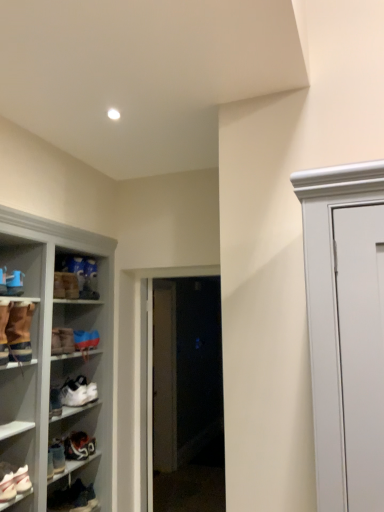
Find the location of a particular element. The height and width of the screenshot is (512, 384). matte blue sneaker at left, which is the 1th footwear in top-to-bottom order is located at coordinates (11, 282).

You are a GUI agent. You are given a task and a screenshot of the screen. Output one action in this format:
    pyautogui.click(x=<x>, y=<y>)
    Task: Click on the white matte sneaker at lower left, marked as the fourth footwear in a bottom-to-top arrangement
    This screenshot has width=384, height=512.
    Given the screenshot: What is the action you would take?
    pyautogui.click(x=72, y=395)

The height and width of the screenshot is (512, 384). I want to click on blue suede sneakers at lower left, the fifth footwear when ordered from bottom to top, so click(x=73, y=340).

Locate an element on the screen. The height and width of the screenshot is (512, 384). brown suede boot at left, the sixth footwear positioned from the bottom is located at coordinates (19, 331).

The height and width of the screenshot is (512, 384). I want to click on dark brown leather shoe at lower left, which is the 1th footwear in bottom-to-top order, so click(x=73, y=498).

Find the location of a particular element. Image resolution: width=384 pixels, height=512 pixels. white leather sneakers at lower left, the 6th footwear positioned from the top is located at coordinates (13, 481).

In order to click on transparent glass door at center in this screenshot , I will do `click(187, 396)`.

Find the location of a particular element. The height and width of the screenshot is (512, 384). matte blue sneaker at left, which is the 1th footwear in top-to-bottom order is located at coordinates (11, 282).

Is brown suede boot at left, the sixth footwear positioned from the bottom, wider or thinner than transparent glass door at center?

Clearly, brown suede boot at left, the sixth footwear positioned from the bottom, has more width compared to transparent glass door at center.

Locate an element on the screen. This screenshot has height=512, width=384. glass door that is behind the brown suede boot at left, placed as the 3th footwear when sorted from top to bottom is located at coordinates (187, 396).

From a real-world perspective, relative to transparent glass door at center, is brown suede boot at left, placed as the 3th footwear when sorted from top to bottom, vertically above or below?

Clearly, from a real-world perspective, brown suede boot at left, placed as the 3th footwear when sorted from top to bottom, is above transparent glass door at center.

Can you confirm if brown suede boot at left, placed as the 3th footwear when sorted from top to bottom, is taller than transparent glass door at center?

No.

How many degrees apart are the facing directions of matte blue sneaker at left, marked as the eighth footwear in a bottom-to-top arrangement, and white matte sneaker at lower left, which is the fifth footwear from top to bottom?

The facing directions of matte blue sneaker at left, marked as the eighth footwear in a bottom-to-top arrangement, and white matte sneaker at lower left, which is the fifth footwear from top to bottom, are 9.69 degrees apart.

Between matte blue sneaker at left, marked as the eighth footwear in a bottom-to-top arrangement, and white matte sneaker at lower left, which is the fifth footwear from top to bottom, which one has smaller width?

With smaller width is matte blue sneaker at left, marked as the eighth footwear in a bottom-to-top arrangement.

Does matte blue sneaker at left, which is the 1th footwear in top-to-bottom order, have a larger size compared to white matte sneaker at lower left, which is the fifth footwear from top to bottom?

No.

From a real-world perspective, which object stands above the other?

From a 3D spatial view, matte blue sneaker at left, marked as the eighth footwear in a bottom-to-top arrangement, is above.

Relative to blue suede sneakers at lower left, the fifth footwear when ordered from bottom to top, is white leather sneakers at lower left, the 6th footwear positioned from the top, in front or behind?

white leather sneakers at lower left, the 6th footwear positioned from the top, is positioned closer to the viewer than blue suede sneakers at lower left, the fifth footwear when ordered from bottom to top.

This screenshot has height=512, width=384. Identify the location of footwear that is the 2nd one when counting downward from the blue suede sneakers at lower left, placed as the 4th footwear when sorted from top to bottom (from the image's perspective). (13, 481).

Is white leather sneakers at lower left, arranged as the third footwear when ordered from the bottom, not near blue suede sneakers at lower left, placed as the 4th footwear when sorted from top to bottom?

No, white leather sneakers at lower left, arranged as the third footwear when ordered from the bottom, is not far from blue suede sneakers at lower left, placed as the 4th footwear when sorted from top to bottom.

Considering the points (1, 488) and (68, 338), which point is in front, point (1, 488) or point (68, 338)?

Point (1, 488)

Which object is thinner, matte brown boot at upper left, which is counted as the second footwear, starting from the top, or brown suede boot at left, the sixth footwear positioned from the bottom?

matte brown boot at upper left, which is counted as the second footwear, starting from the top.

Which object is further away from the camera taking this photo, matte brown boot at upper left, the seventh footwear in the bottom-to-top sequence, or brown suede boot at left, placed as the 3th footwear when sorted from top to bottom?

matte brown boot at upper left, the seventh footwear in the bottom-to-top sequence, is more distant.

How far apart are matte brown boot at upper left, the seventh footwear in the bottom-to-top sequence, and brown suede boot at left, placed as the 3th footwear when sorted from top to bottom?

matte brown boot at upper left, the seventh footwear in the bottom-to-top sequence, is 14.09 inches from brown suede boot at left, placed as the 3th footwear when sorted from top to bottom.

From a real-world perspective, between matte brown boot at upper left, which is counted as the second footwear, starting from the top, and brown suede boot at left, the sixth footwear positioned from the bottom, who is vertically lower?

In real-world perspective, brown suede boot at left, the sixth footwear positioned from the bottom, is lower.

Is the surface of brown suede boot at left, placed as the 3th footwear when sorted from top to bottom, in direct contact with dark brown leather shoe at lower left, which is the 1th footwear in bottom-to-top order?

No, brown suede boot at left, placed as the 3th footwear when sorted from top to bottom, is not with dark brown leather shoe at lower left, which is the 1th footwear in bottom-to-top order.

Which of these two, brown suede boot at left, placed as the 3th footwear when sorted from top to bottom, or dark brown leather shoe at lower left, acting as the eighth footwear starting from the top, is wider?

dark brown leather shoe at lower left, acting as the eighth footwear starting from the top, is wider.

Which is more to the left, brown suede boot at left, the sixth footwear positioned from the bottom, or dark brown leather shoe at lower left, acting as the eighth footwear starting from the top?

From the viewer's perspective, brown suede boot at left, the sixth footwear positioned from the bottom, appears more on the left side.

Who is smaller, brown suede boot at left, placed as the 3th footwear when sorted from top to bottom, or dark brown leather shoe at lower left, acting as the eighth footwear starting from the top?

With smaller size is dark brown leather shoe at lower left, acting as the eighth footwear starting from the top.

Is there a large distance between brown suede boot at left, placed as the 3th footwear when sorted from top to bottom, and blue suede sneakers at lower left, placed as the 4th footwear when sorted from top to bottom?

No.

From a real-world perspective, is brown suede boot at left, placed as the 3th footwear when sorted from top to bottom, over blue suede sneakers at lower left, placed as the 4th footwear when sorted from top to bottom?

Yes, from a real-world perspective, brown suede boot at left, placed as the 3th footwear when sorted from top to bottom, is on top of blue suede sneakers at lower left, placed as the 4th footwear when sorted from top to bottom.

Is brown suede boot at left, placed as the 3th footwear when sorted from top to bottom, situated inside blue suede sneakers at lower left, placed as the 4th footwear when sorted from top to bottom, or outside?

brown suede boot at left, placed as the 3th footwear when sorted from top to bottom, cannot be found inside blue suede sneakers at lower left, placed as the 4th footwear when sorted from top to bottom.

Does brown suede boot at left, the sixth footwear positioned from the bottom, appear on the left side of blue suede sneakers at lower left, placed as the 4th footwear when sorted from top to bottom?

Yes.

Consider the image. Is white leather sneaker at lower left, which is the seventh footwear in top-to-bottom order, surrounding transparent glass door at center?

No, transparent glass door at center is not surrounded by white leather sneaker at lower left, which is the seventh footwear in top-to-bottom order.

This screenshot has width=384, height=512. I want to click on glass door that is on the right side of white leather sneaker at lower left, which is the seventh footwear in top-to-bottom order, so click(187, 396).

Which of these two, white leather sneaker at lower left, which appears as the 2th footwear when ordered from the bottom, or transparent glass door at center, stands taller?

transparent glass door at center is taller.

Where is `glass door below the brown suede boot at left, the sixth footwear positioned from the bottom (from a real-world perspective)`? This screenshot has width=384, height=512. glass door below the brown suede boot at left, the sixth footwear positioned from the bottom (from a real-world perspective) is located at coordinates (187, 396).

Image resolution: width=384 pixels, height=512 pixels. In order to click on the 4th footwear above the white matte sneaker at lower left, marked as the fourth footwear in a bottom-to-top arrangement (from the image's perspective) in this screenshot , I will do `click(11, 282)`.

From the image, which object appears to be nearer to white leather sneaker at lower left, which appears as the 2th footwear when ordered from the bottom, brown suede boot at left, the sixth footwear positioned from the bottom, or white matte sneaker at lower left, which is the fifth footwear from top to bottom?

Among the two, white matte sneaker at lower left, which is the fifth footwear from top to bottom, is located nearer to white leather sneaker at lower left, which appears as the 2th footwear when ordered from the bottom.

Considering their positions, is matte brown boot at upper left, which is counted as the second footwear, starting from the top, positioned further to blue suede sneakers at lower left, the fifth footwear when ordered from bottom to top, than transparent glass door at center?

transparent glass door at center lies further to blue suede sneakers at lower left, the fifth footwear when ordered from bottom to top, than the other object.

Based on their spatial positions, is dark brown leather shoe at lower left, which is the 1th footwear in bottom-to-top order, or blue suede sneakers at lower left, placed as the 4th footwear when sorted from top to bottom, further from white leather sneaker at lower left, which is the seventh footwear in top-to-bottom order?

Based on the image, blue suede sneakers at lower left, placed as the 4th footwear when sorted from top to bottom, appears to be further to white leather sneaker at lower left, which is the seventh footwear in top-to-bottom order.

Which object lies nearer to the anchor point white leather sneaker at lower left, which is the seventh footwear in top-to-bottom order, matte brown boot at upper left, which is counted as the second footwear, starting from the top, or white matte sneaker at lower left, marked as the fourth footwear in a bottom-to-top arrangement?

white matte sneaker at lower left, marked as the fourth footwear in a bottom-to-top arrangement.

Considering their positions, is blue suede sneakers at lower left, placed as the 4th footwear when sorted from top to bottom, positioned closer to dark brown leather shoe at lower left, acting as the eighth footwear starting from the top, than transparent glass door at center?

Among the two, blue suede sneakers at lower left, placed as the 4th footwear when sorted from top to bottom, is located nearer to dark brown leather shoe at lower left, acting as the eighth footwear starting from the top.

Which object lies further to the anchor point white leather sneakers at lower left, the 6th footwear positioned from the top, transparent glass door at center or matte brown boot at upper left, which is counted as the second footwear, starting from the top?

The object further to white leather sneakers at lower left, the 6th footwear positioned from the top, is transparent glass door at center.

From the image, which object appears to be nearer to brown suede boot at left, the sixth footwear positioned from the bottom, blue suede sneakers at lower left, the fifth footwear when ordered from bottom to top, or white matte sneaker at lower left, which is the fifth footwear from top to bottom?

The object closer to brown suede boot at left, the sixth footwear positioned from the bottom, is blue suede sneakers at lower left, the fifth footwear when ordered from bottom to top.

Based on their spatial positions, is white matte sneaker at lower left, which is the fifth footwear from top to bottom, or blue suede sneakers at lower left, the fifth footwear when ordered from bottom to top, further from brown suede boot at left, the sixth footwear positioned from the bottom?

The object further to brown suede boot at left, the sixth footwear positioned from the bottom, is white matte sneaker at lower left, which is the fifth footwear from top to bottom.

Locate an element on the screen. This screenshot has height=512, width=384. glass door between matte brown boot at upper left, which is counted as the second footwear, starting from the top, and dark brown leather shoe at lower left, acting as the eighth footwear starting from the top, from top to bottom is located at coordinates (187, 396).

This screenshot has height=512, width=384. What are the coordinates of `glass door that lies between blue suede sneakers at lower left, placed as the 4th footwear when sorted from top to bottom, and dark brown leather shoe at lower left, which is the 1th footwear in bottom-to-top order, from top to bottom` in the screenshot? It's located at (187, 396).

Where is `glass door between matte blue sneaker at left, marked as the eighth footwear in a bottom-to-top arrangement, and dark brown leather shoe at lower left, which is the 1th footwear in bottom-to-top order, in the vertical direction`? glass door between matte blue sneaker at left, marked as the eighth footwear in a bottom-to-top arrangement, and dark brown leather shoe at lower left, which is the 1th footwear in bottom-to-top order, in the vertical direction is located at coordinates (187, 396).

Locate an element on the screen. glass door between matte blue sneaker at left, which is the 1th footwear in top-to-bottom order, and white leather sneaker at lower left, which appears as the 2th footwear when ordered from the bottom, in the vertical direction is located at coordinates (187, 396).